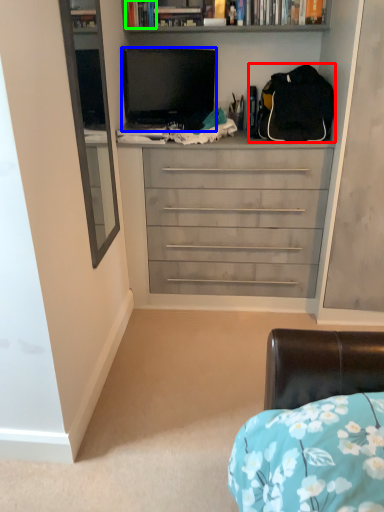
Question: Based on their relative distances, which object is nearer to backpack (highlighted by a red box)? Choose from television (highlighted by a blue box) and book (highlighted by a green box).

Choices:
 (A) television
 (B) book

Answer: (A)